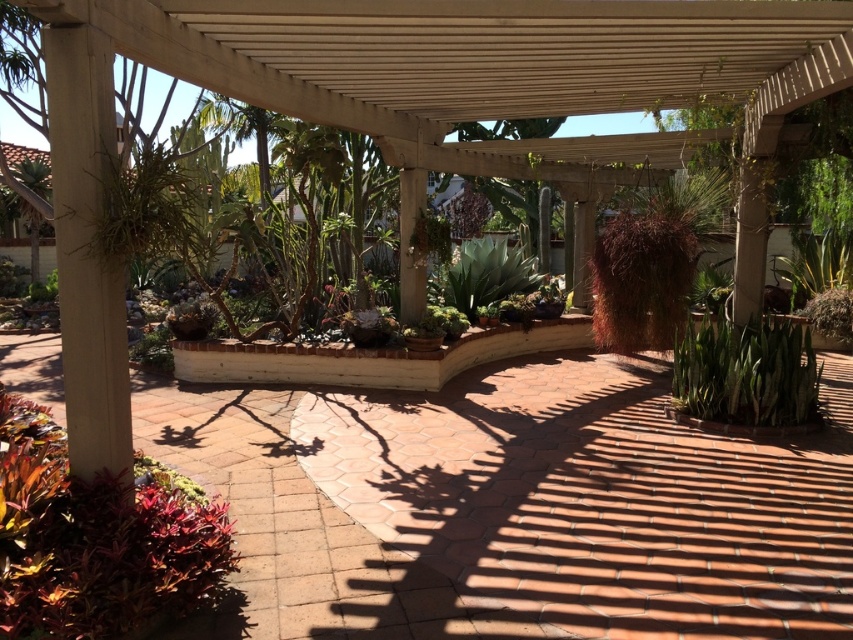
Question: Is multicolored leafy plant at lower left further to camera compared to green succulent at center?

Choices:
 (A) yes
 (B) no

Answer: (B)

Question: Is terracotta tile path at center to the right of multicolored leafy plant at lower left from the viewer's perspective?

Choices:
 (A) yes
 (B) no

Answer: (A)

Question: Which of these objects is positioned farthest from the green succulent at center?

Choices:
 (A) terracotta tile path at center
 (B) multicolored leafy plant at lower left
 (C) green leafy plant at right

Answer: (A)

Question: Is terracotta tile path at center wider than green succulent at center?

Choices:
 (A) yes
 (B) no

Answer: (A)

Question: Considering the real-world distances, which object is closest to the multicolored leafy plant at lower left?

Choices:
 (A) green succulent at center
 (B) terracotta tile path at center
 (C) green leafy plant at right

Answer: (B)

Question: Estimate the real-world distances between objects in this image. Which object is closer to the terracotta tile path at center?

Choices:
 (A) green succulent at center
 (B) green leafy plant at right
 (C) multicolored leafy plant at lower left

Answer: (C)